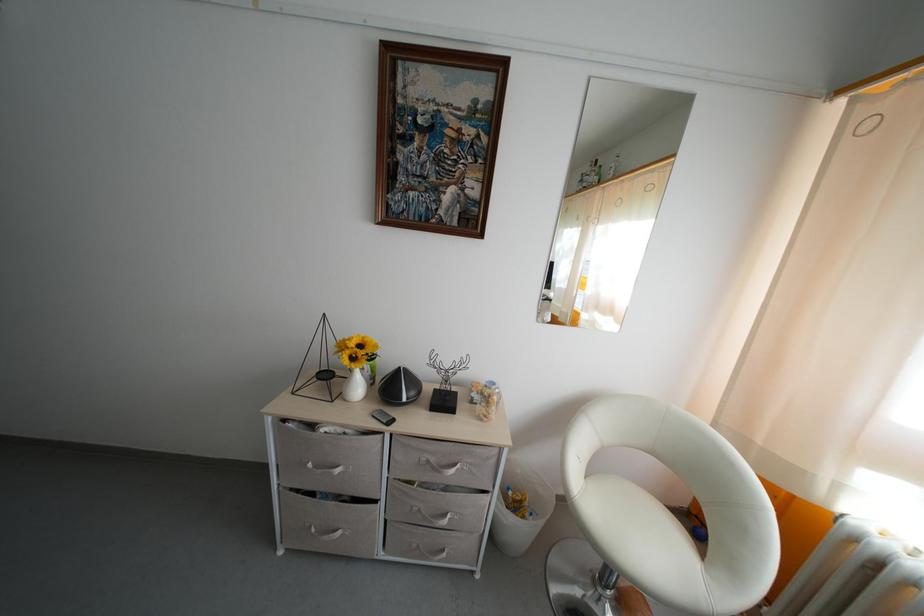
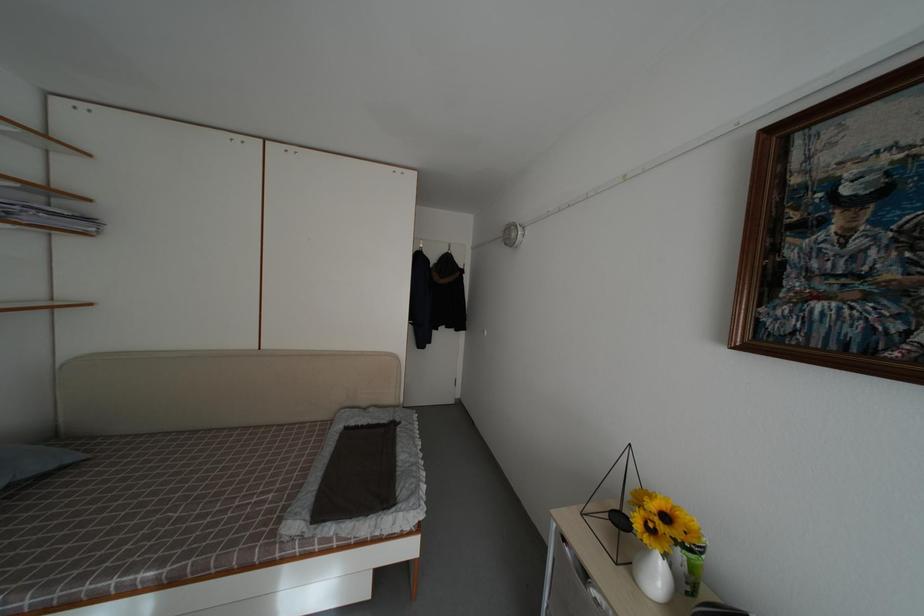
Question: The camera is either moving clockwise (left) or counter-clockwise (right) around the object. The first image is from the beginning of the video and the second image is from the end. Is the camera moving left or right when shooting the video?

Choices:
 (A) Left
 (B) Right

Answer: (B)